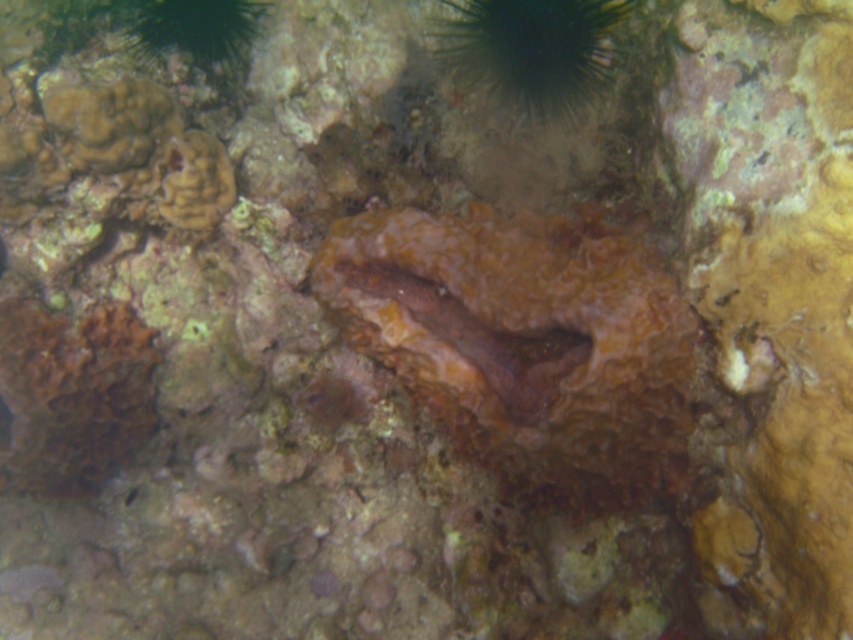
You are a marine biologist observing an underwater scene. You notice an orange sponge at center and a brown rough coral at lower left. Which object is positioned higher in the water column?

The orange sponge at center is positioned higher in the water column than the brown rough coral at lower left.

You are a scuba diver swimming in the underwater scene. You notice two points marked in the image. Which point is farther away from you, point at (80, 385) or point at (558, 20)?

Point at (80, 385) is farther away from you than point at (558, 20) because the Objects Description states that point at (80, 385) is behind point at (558, 20).

You are a marine biologist examining an underwater scene. You need to determine which object is taller between the orange sponge at center and the green spiky sea urchin at upper center. Based on the scene, which one is taller?

The orange sponge at center is much taller than the green spiky sea urchin at upper center.